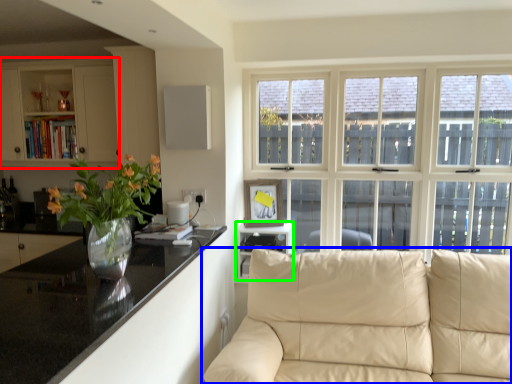
Question: Which object is positioned farthest from cabinetry (highlighted by a red box)? Select from studio couch (highlighted by a blue box) and shelf (highlighted by a green box).

Choices:
 (A) studio couch
 (B) shelf

Answer: (A)